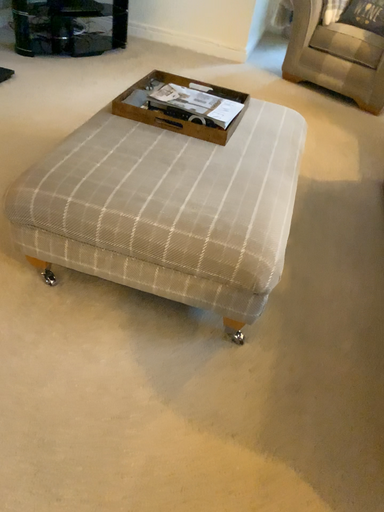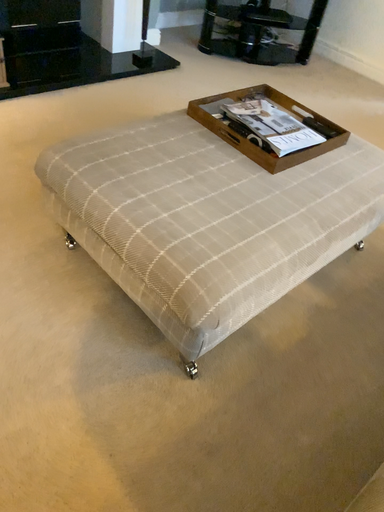
Question: Which way did the camera rotate in the video?

Choices:
 (A) rotated upward
 (B) rotated downward

Answer: (A)